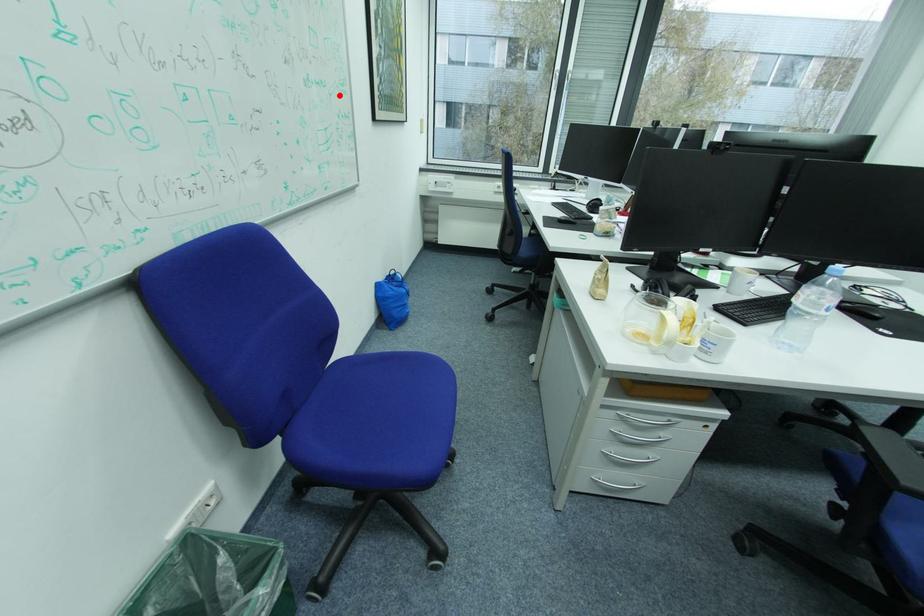
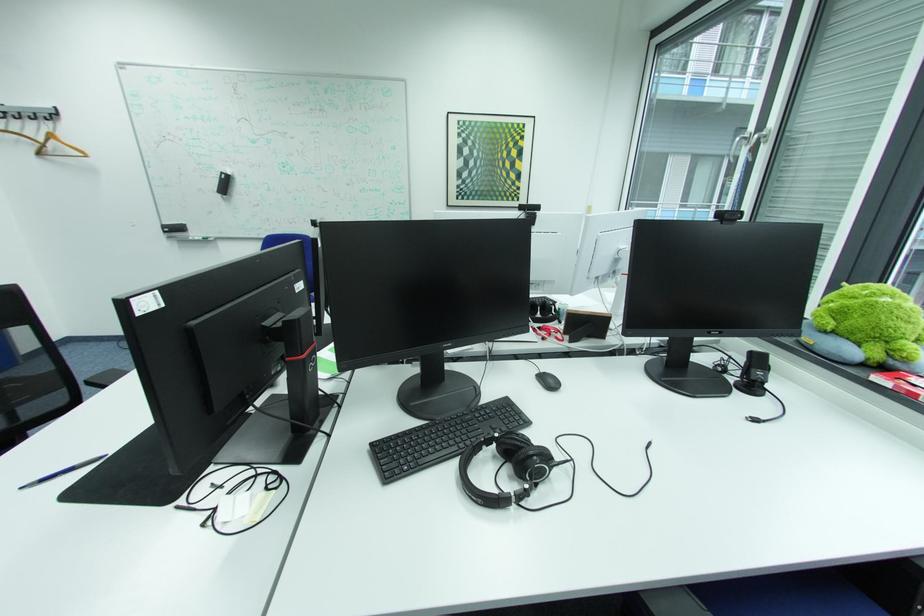
Question: I am providing you with two images of the same scene from different viewpoints. A red point is marked on the first image. At the location where the point appears in image 1, is it still visible in image 2?

Choices:
 (A) Yes
 (B) No

Answer: (A)